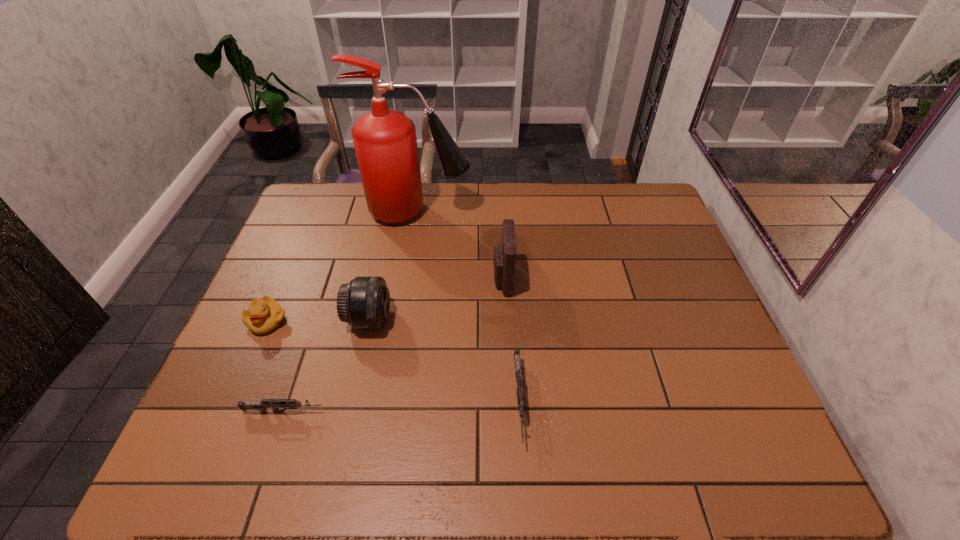
Find the location of a particular element. This screenshot has height=540, width=960. object that is at the near left corner is located at coordinates (275, 404).

This screenshot has width=960, height=540. I want to click on vacant position at the far edge of the desktop, so click(478, 195).

This screenshot has height=540, width=960. In the image, there is a desktop. Identify the location of free space at the near edge. (538, 406).

Locate an element on the screen. The height and width of the screenshot is (540, 960). free space at the left edge of the desktop is located at coordinates (295, 352).

What are the coordinates of `vacant space at the right edge` in the screenshot? It's located at (674, 300).

Find the location of a particular element. free spot at the far left corner of the desktop is located at coordinates (338, 197).

At what (x,y) coordinates should I click in order to perform the action: click on free space at the near left corner of the desktop. Please return your answer as a coordinate pair (x, y). The image size is (960, 540). Looking at the image, I should click on (219, 390).

This screenshot has height=540, width=960. In order to click on vacant space at the near right corner of the desktop in this screenshot , I will do `click(704, 404)`.

Find the location of `blank region between the telephoto lens and the shorter gun`. blank region between the telephoto lens and the shorter gun is located at coordinates (326, 366).

Locate an element on the screen. This screenshot has width=960, height=540. empty space that is in between the second shortest object and the pouch is located at coordinates click(x=511, y=340).